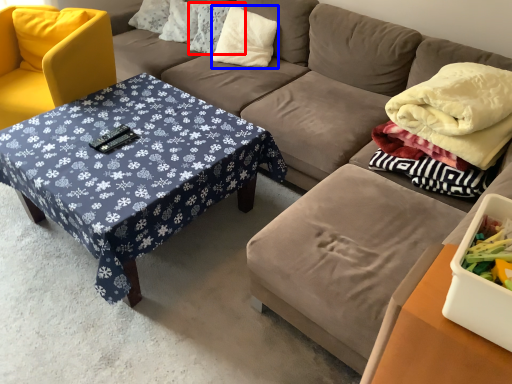
Question: Which object appears closest to the camera in this image, pillow (highlighted by a red box) or pillow (highlighted by a blue box)?

Choices:
 (A) pillow
 (B) pillow

Answer: (B)